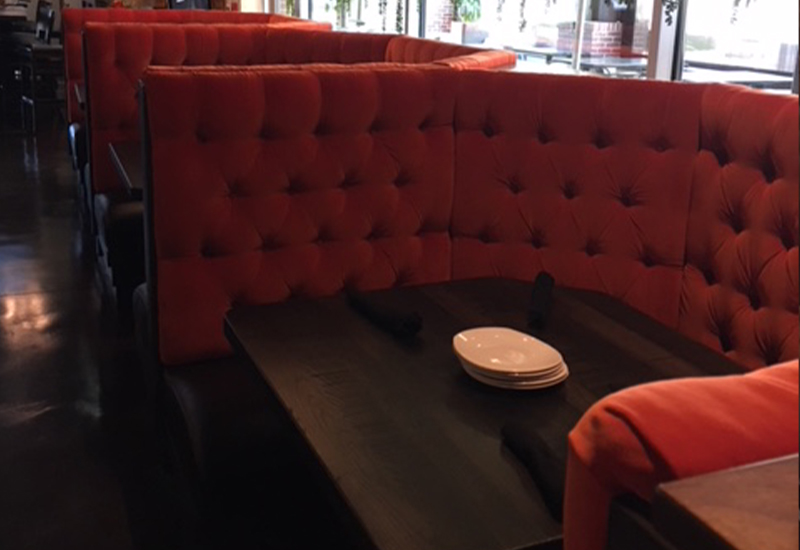
You are a GUI agent. You are given a task and a screenshot of the screen. Output one action in this format:
    pyautogui.click(x=<x>, y=<y>)
    Task: Click on the dark hardwood floor
    The image size is (800, 550).
    Given the screenshot: What is the action you would take?
    pyautogui.click(x=24, y=141), pyautogui.click(x=86, y=456), pyautogui.click(x=40, y=277)